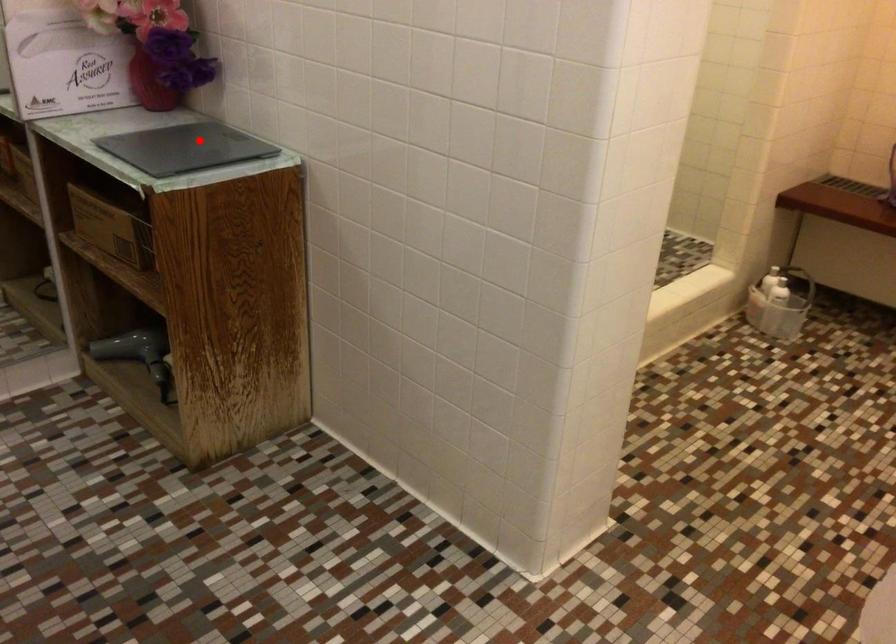
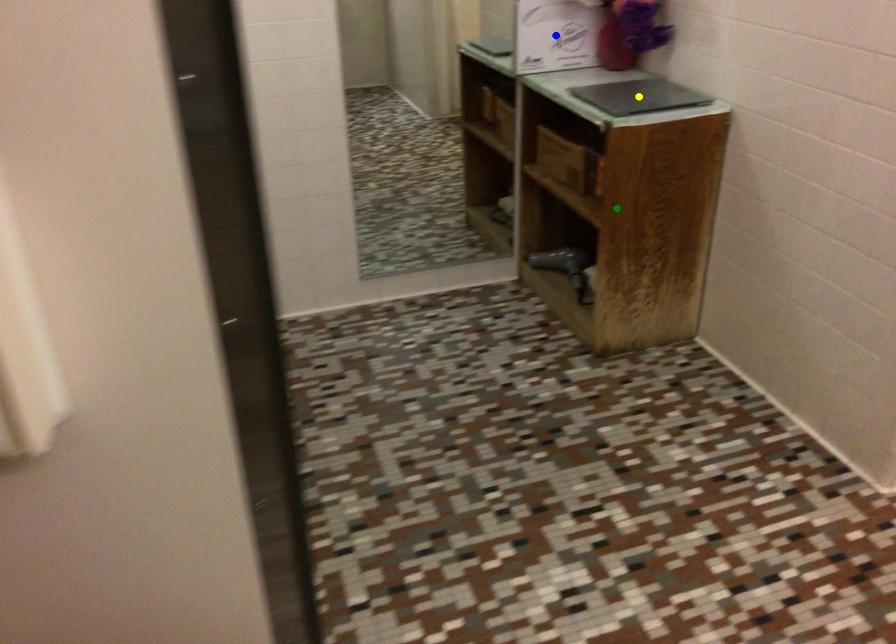
Question: I am providing you with two images of the same scene from different viewpoints. A red point is marked on the first image. You are given multiple points on the second image. Which point in image 2 represents the same 3d spot as the red point in image 1?

Choices:
 (A) blue point
 (B) green point
 (C) yellow point

Answer: (C)